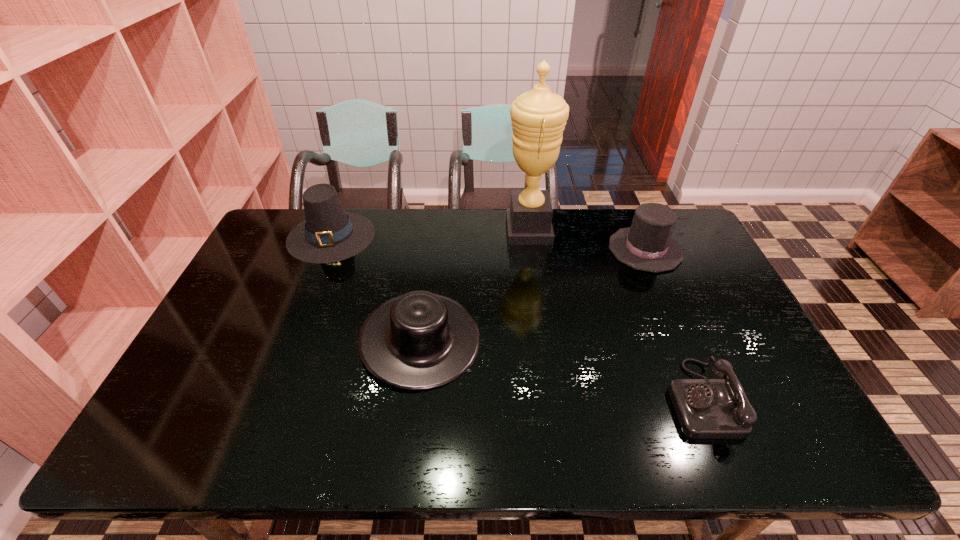
You are a GUI agent. You are given a task and a screenshot of the screen. Output one action in this format:
    pyautogui.click(x=<x>, y=<y>)
    Task: Click on the free space located 0.090m at the front of the trophy cup with handles
    Image resolution: width=960 pixels, height=540 pixels.
    Given the screenshot: What is the action you would take?
    pyautogui.click(x=479, y=230)

Locate an element on the screen. Image resolution: width=960 pixels, height=540 pixels. free spot located 0.130m on the front-facing side of the leftmost object is located at coordinates (308, 292).

At what (x,y) coordinates should I click in order to perform the action: click on free space located 0.350m on the front of the rightmost dress hat with the decoration. Please return your answer as a coordinate pair (x, y). Image resolution: width=960 pixels, height=540 pixels. Looking at the image, I should click on (695, 365).

Identify the location of free space located on the left of the second dress hat from left to right. (302, 340).

In order to click on free space located on the dial of the telephone in this screenshot , I will do `click(596, 399)`.

The width and height of the screenshot is (960, 540). What are the coordinates of `vacant space located on the dial of the telephone` in the screenshot? It's located at (543, 399).

Locate an element on the screen. vacant space situated 0.350m on the dial of the telephone is located at coordinates (527, 399).

Locate an element on the screen. trophy cup at the far edge is located at coordinates (538, 117).

This screenshot has height=540, width=960. Identify the location of object at the near edge. (706, 408).

At what (x,y) coordinates should I click in order to perform the action: click on object present at the left edge. Please return your answer as a coordinate pair (x, y). Looking at the image, I should click on (328, 234).